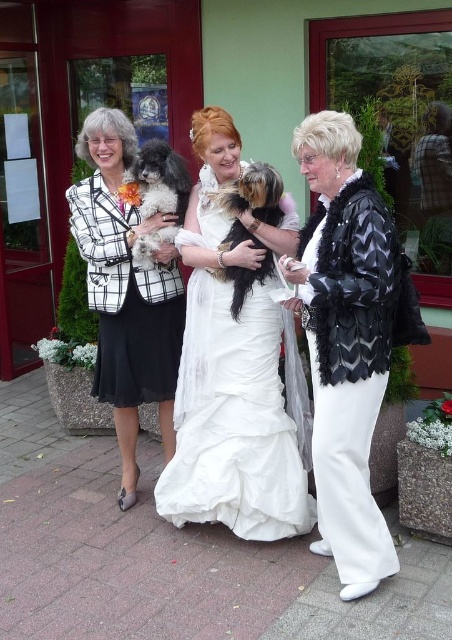
You are a photographer trying to capture a closeup shot of the matte black blazer at left and the fuzzy brown dog at center. Your camera has a minimum focusing distance of 18 inches. Can you take the photo without moving either object?

The distance between the matte black blazer at left and the fuzzy brown dog at center is 19.52 inches, which is greater than the camera minimum focusing distance of 18 inches. Therefore, you can take the photo without moving either object.

You are standing in front of the wedding photo and want to place a decorative ribbon at the point closer to you between the two points marked as point (x=258, y=285) and point (x=235, y=184). Which point should you choose?

You should choose point (x=258, y=285) because it is closer to the viewer than point (x=235, y=184).